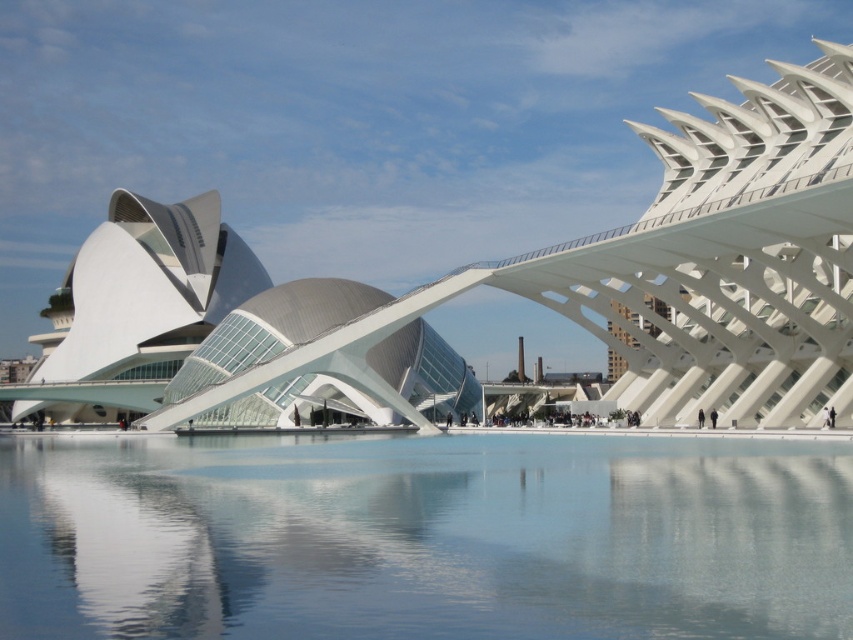
Question: Can you confirm if transparent glass water at center is positioned below white matte building at center?

Choices:
 (A) no
 (B) yes

Answer: (B)

Question: Does transparent glass water at center appear over white matte building at center?

Choices:
 (A) no
 (B) yes

Answer: (A)

Question: Considering the relative positions of transparent glass water at center and white matte building at center in the image provided, where is transparent glass water at center located with respect to white matte building at center?

Choices:
 (A) below
 (B) above

Answer: (A)

Question: Among these objects, which one is nearest to the camera?

Choices:
 (A) transparent glass water at center
 (B) white matte building at center

Answer: (A)